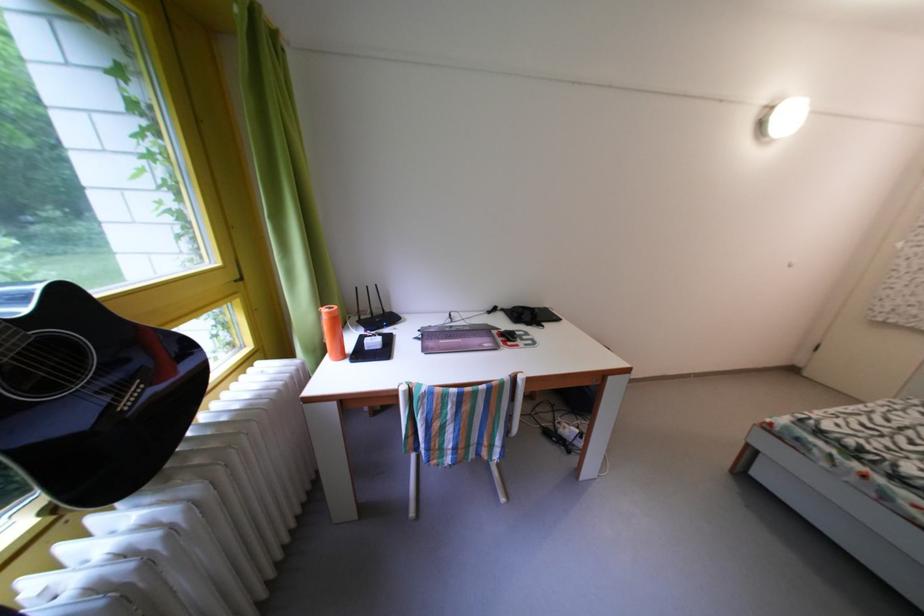
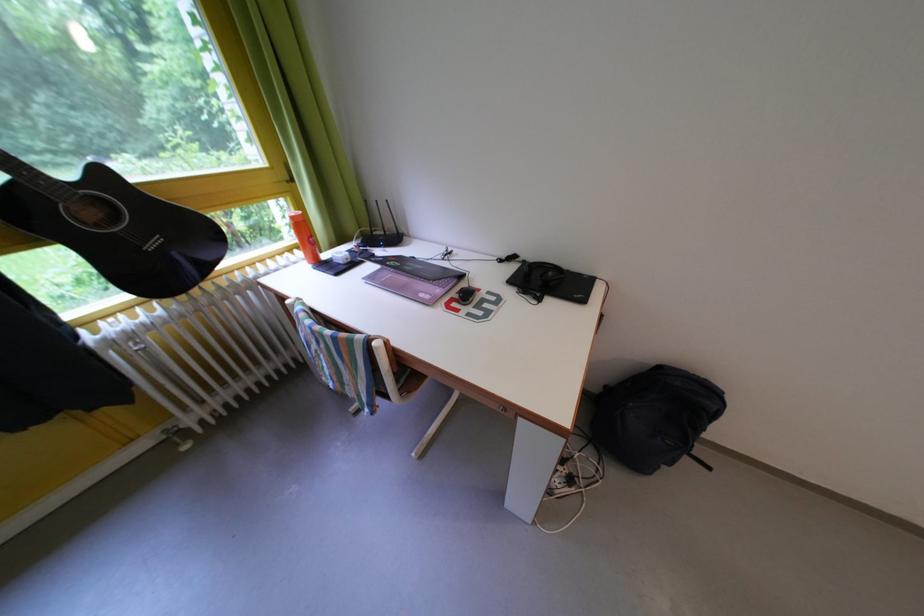
Where in the second image is the point corresponding to [512,315] from the first image?

(533, 267)